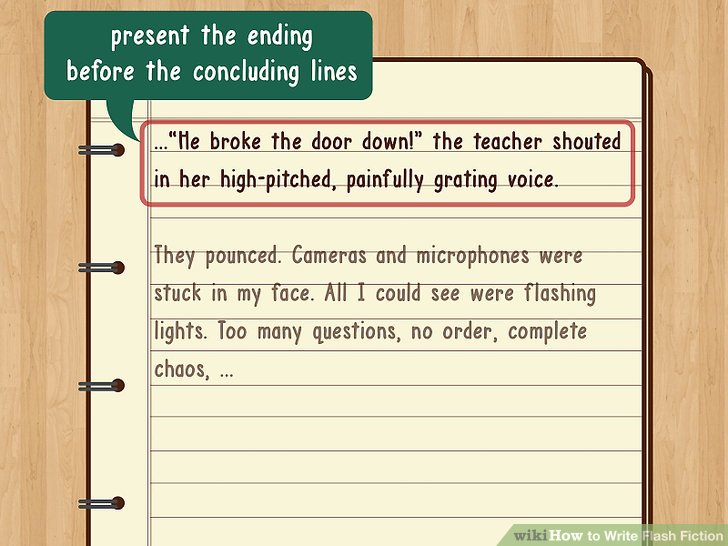
Locate an element on the screen. wooden table is located at coordinates (684, 307).